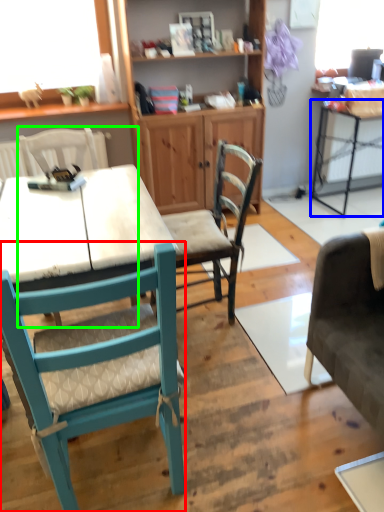
Question: Estimate the real-world distances between objects in this image. Which object is farther from chair (highlighted by a red box), table (highlighted by a blue box) or chair (highlighted by a green box)?

Choices:
 (A) table
 (B) chair

Answer: (A)